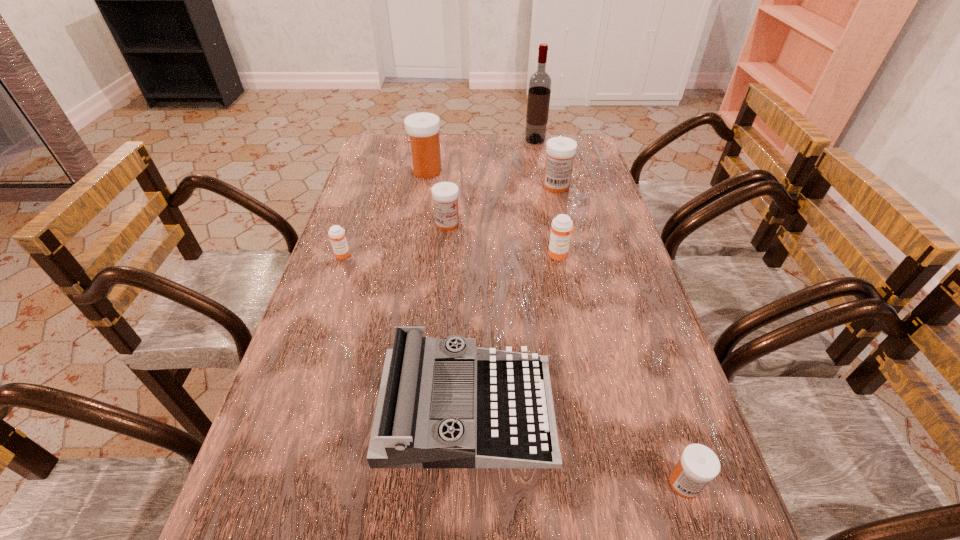
Locate an element on the screen. This screenshot has width=960, height=540. the leftmost object is located at coordinates (336, 233).

The image size is (960, 540). In order to click on the left orange medicine in this screenshot , I will do `click(336, 233)`.

Identify the location of the rightmost medicine. This screenshot has width=960, height=540. (698, 465).

Locate an element on the screen. The height and width of the screenshot is (540, 960). the smallest white medicine is located at coordinates (698, 465).

Locate an element on the screen. free space located on the front of the farthest object is located at coordinates (540, 169).

Identify the location of free region located on the front of the seventh shortest object. (420, 208).

Locate an element on the screen. This screenshot has width=960, height=540. free space located on the front of the third tallest object is located at coordinates [x=562, y=211].

Locate an element on the screen. Image resolution: width=960 pixels, height=540 pixels. free space located 0.310m on the right of the third farthest medicine is located at coordinates (565, 224).

You are a GUI agent. You are given a task and a screenshot of the screen. Output one action in this format:
    pyautogui.click(x=<x>, y=<y>)
    Task: Click on the vacant space located on the front of the right orange medicine
    The image size is (960, 540).
    Given the screenshot: What is the action you would take?
    pyautogui.click(x=564, y=280)

The height and width of the screenshot is (540, 960). I want to click on blank area located on the typing side of the black typewriter, so click(x=645, y=409).